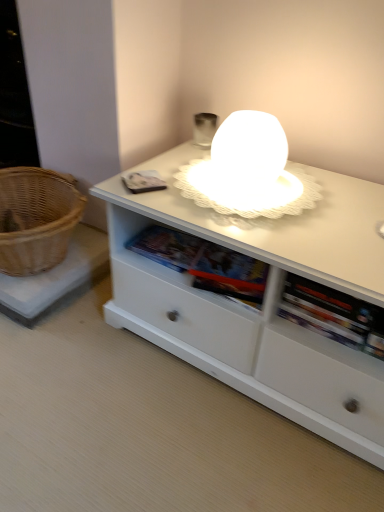
Describe the element at coordinates (264, 300) in the screenshot. I see `white matte cabinet at center` at that location.

You are a GUI agent. You are given a task and a screenshot of the screen. Output one action in this format:
    pyautogui.click(x=<x>, y=<y>)
    Task: Click on the white matte cabinet at center
    
    Given the screenshot: What is the action you would take?
    pyautogui.click(x=264, y=300)

This screenshot has width=384, height=512. What are the coordinates of `woven brown basket at left` in the screenshot? It's located at (36, 219).

Describe the element at coordinates (36, 219) in the screenshot. I see `woven brown basket at left` at that location.

At what (x,y) coordinates should I click in order to perform the action: click on white matte cabinet at center. Please return your answer as a coordinate pair (x, y). The width and height of the screenshot is (384, 512). Looking at the image, I should click on (264, 300).

Is white matte cabinet at center to the left of woven brown basket at left from the viewer's perspective?

No.

Which object is further away from the camera, white matte cabinet at center or woven brown basket at left?

woven brown basket at left is more distant.

Is point (140, 197) closer to viewer compared to point (2, 173)?

Yes, it is.

From the image's perspective, is white matte cabinet at center over woven brown basket at left?

No, from the image's perspective, white matte cabinet at center is not on top of woven brown basket at left.

From a real-world perspective, who is located higher, white matte cabinet at center or woven brown basket at left?

From a 3D spatial view, woven brown basket at left is above.

Considering the relative sizes of white matte cabinet at center and woven brown basket at left in the image provided, is white matte cabinet at center thinner than woven brown basket at left?

In fact, white matte cabinet at center might be wider than woven brown basket at left.

Is white matte cabinet at center shorter than woven brown basket at left?

Correct, white matte cabinet at center is not as tall as woven brown basket at left.

Looking at this image, based on their sizes in the image, would you say white matte cabinet at center is bigger or smaller than woven brown basket at left?

Considering their sizes, white matte cabinet at center takes up more space than woven brown basket at left.

Is white matte cabinet at center positioned beyond the bounds of woven brown basket at left?

Yes, white matte cabinet at center is located beyond the bounds of woven brown basket at left.

From the picture: Is white matte cabinet at center placed right next to woven brown basket at left?

No.

Is white matte cabinet at center looking in the opposite direction of woven brown basket at left?

No.

Locate an element on the screen. basket that appears above the white matte cabinet at center (from the image's perspective) is located at coordinates (36, 219).

Considering the relative positions of woven brown basket at left and white matte cabinet at center in the image provided, is woven brown basket at left to the right of white matte cabinet at center from the viewer's perspective?

In fact, woven brown basket at left is to the left of white matte cabinet at center.

Which object is closer to the camera, woven brown basket at left or white matte cabinet at center?

white matte cabinet at center is closer to the camera.

Does point (53, 246) come behind point (167, 340)?

Yes, point (53, 246) is farther from viewer.

From the image's perspective, between woven brown basket at left and white matte cabinet at center, which one is located above?

From the image's view, woven brown basket at left is above.

From a real-world perspective, which is physically above, woven brown basket at left or white matte cabinet at center?

woven brown basket at left.

Looking at this image, in terms of width, does woven brown basket at left look wider or thinner when compared to white matte cabinet at center?

Clearly, woven brown basket at left has less width compared to white matte cabinet at center.

Can you confirm if woven brown basket at left is shorter than white matte cabinet at center?

In fact, woven brown basket at left may be taller than white matte cabinet at center.

Between woven brown basket at left and white matte cabinet at center, which one has smaller size?

woven brown basket at left is smaller.

Is woven brown basket at left inside or outside of white matte cabinet at center?

woven brown basket at left exists outside the volume of white matte cabinet at center.

Is woven brown basket at left positioned far away from white matte cabinet at center?

They are positioned close to each other.

Is woven brown basket at left oriented towards white matte cabinet at center?

No, woven brown basket at left is not aimed at white matte cabinet at center.

What's the angular difference between woven brown basket at left and white matte cabinet at center's facing directions?

They differ by 0.631 degrees in their facing directions.

Locate an element on the screen. table that appears in front of the woven brown basket at left is located at coordinates (264, 300).

The width and height of the screenshot is (384, 512). I want to click on table lying on the right of woven brown basket at left, so click(264, 300).

At what (x,y) coordinates should I click in order to perform the action: click on basket that appears on the left of white matte cabinet at center. Please return your answer as a coordinate pair (x, y). The image size is (384, 512). Looking at the image, I should click on (36, 219).